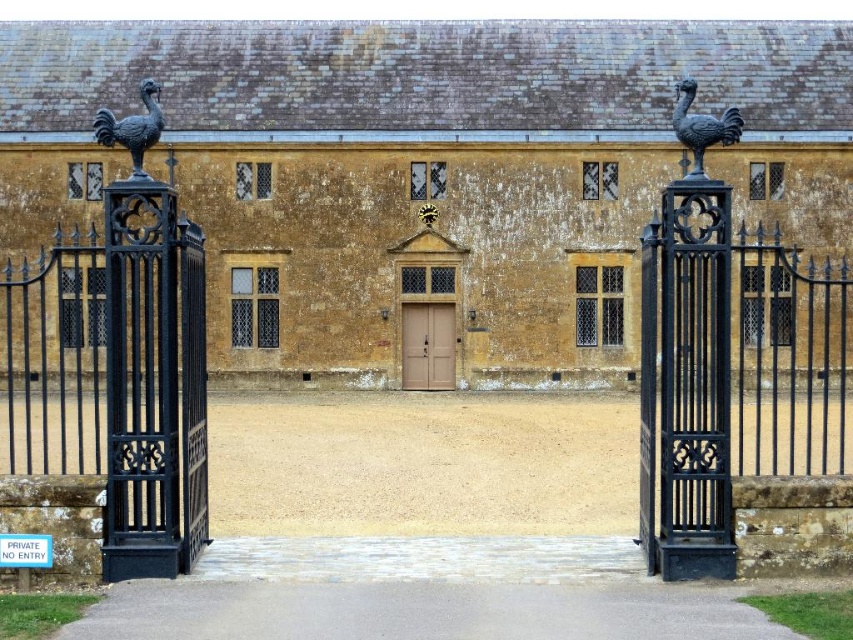
Between black wrought iron gate at center and black wrought iron gate at right, which one has more height?

Standing taller between the two is black wrought iron gate at right.

Based on the photo, can you confirm if black wrought iron gate at center is positioned to the left of black wrought iron gate at right?

Indeed, black wrought iron gate at center is positioned on the left side of black wrought iron gate at right.

Does point (183, 321) come farther from viewer compared to point (833, 429)?

No.

Find the location of `black wrought iron gate at center`. black wrought iron gate at center is located at coordinates (115, 376).

Between matte gold stone building at center and brown wooden door at center, which one appears on the left side from the viewer's perspective?

From the viewer's perspective, brown wooden door at center appears more on the left side.

Which is above, matte gold stone building at center or brown wooden door at center?

matte gold stone building at center is above.

Is point (590, 243) closer to viewer compared to point (444, 326)?

Yes.

Where is `matte gold stone building at center`? This screenshot has width=853, height=640. matte gold stone building at center is located at coordinates (426, 172).

Can you confirm if matte gold stone building at center is taller than black wrought iron gate at center?

Yes.

Is point (583, 26) positioned behind point (132, 285)?

Yes, it is behind point (132, 285).

You are a GUI agent. You are given a task and a screenshot of the screen. Output one action in this format:
    pyautogui.click(x=<x>, y=<y>)
    Task: Click on the matte gold stone building at center
    
    Given the screenshot: What is the action you would take?
    pyautogui.click(x=426, y=172)